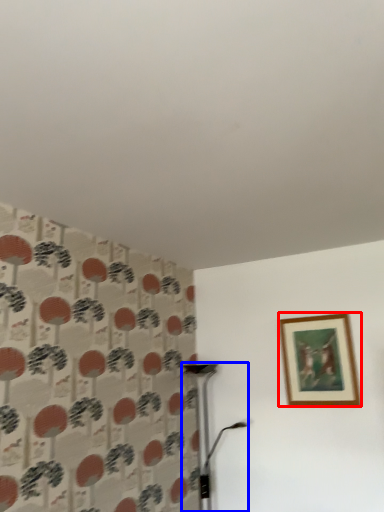
Question: Among these objects, which one is nearest to the camera, picture frame (highlighted by a red box) or table lamp (highlighted by a blue box)?

Choices:
 (A) picture frame
 (B) table lamp

Answer: (B)